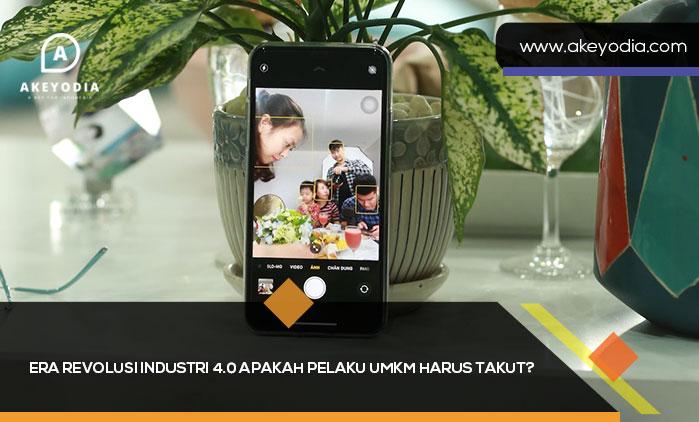
This screenshot has width=699, height=422. Identify the location of glass. (549, 206), (224, 75).